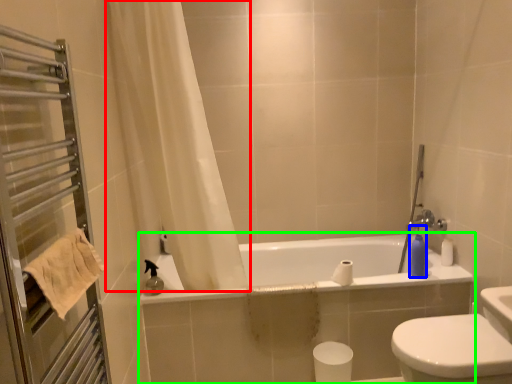
Question: Considering the real-world distances, which object is farthest from curtain (highlighted by a red box)? soap dispenser (highlighted by a blue box) or bathtub (highlighted by a green box)?

Choices:
 (A) soap dispenser
 (B) bathtub

Answer: (A)